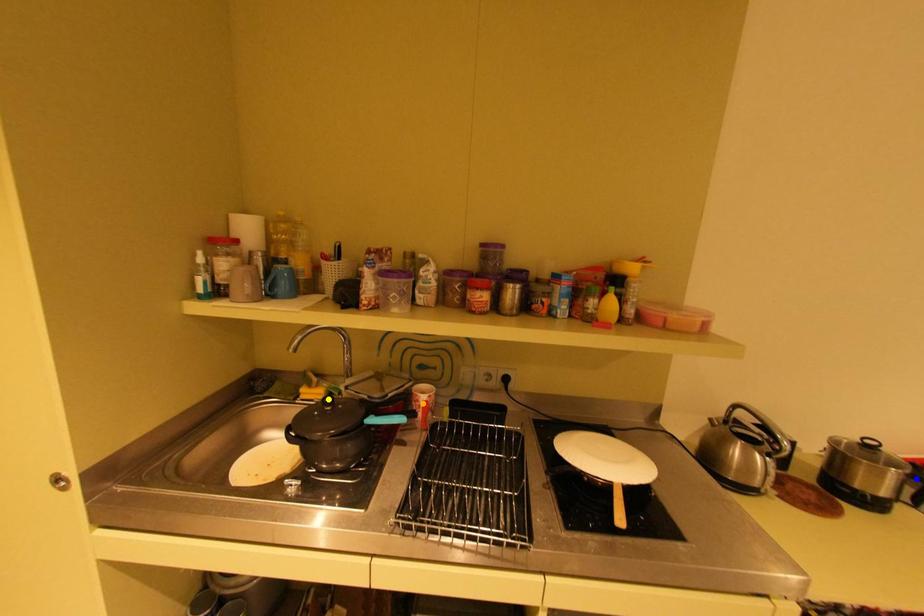
Order these from nearest to farthest:
orange point, blue point, yellow point

orange point, yellow point, blue point